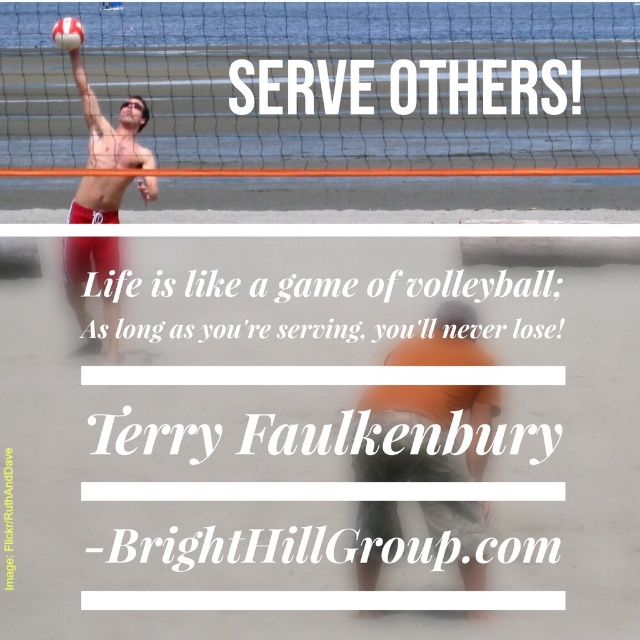
You are looking at a motivational poster featuring a beach volleyball scene. You see the matte skin at center and the matte red shorts at left. Which object is positioned to the right of the other?

The matte skin at center is to the right of matte red shorts at left.